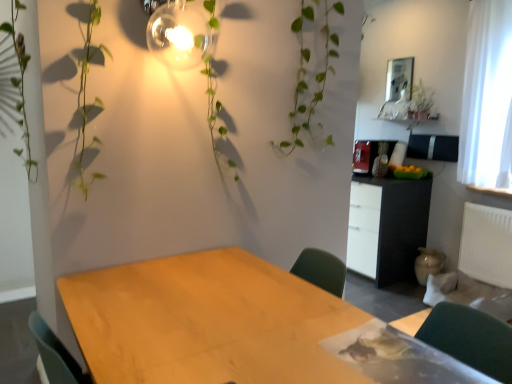
You are a GUI agent. You are given a task and a screenshot of the screen. Output one action in this format:
    pyautogui.click(x=<x>, y=<y>)
    Task: Click on the blank space situated above wooden table at center (from a real-world perspective)
    
    Given the screenshot: What is the action you would take?
    pyautogui.click(x=219, y=314)